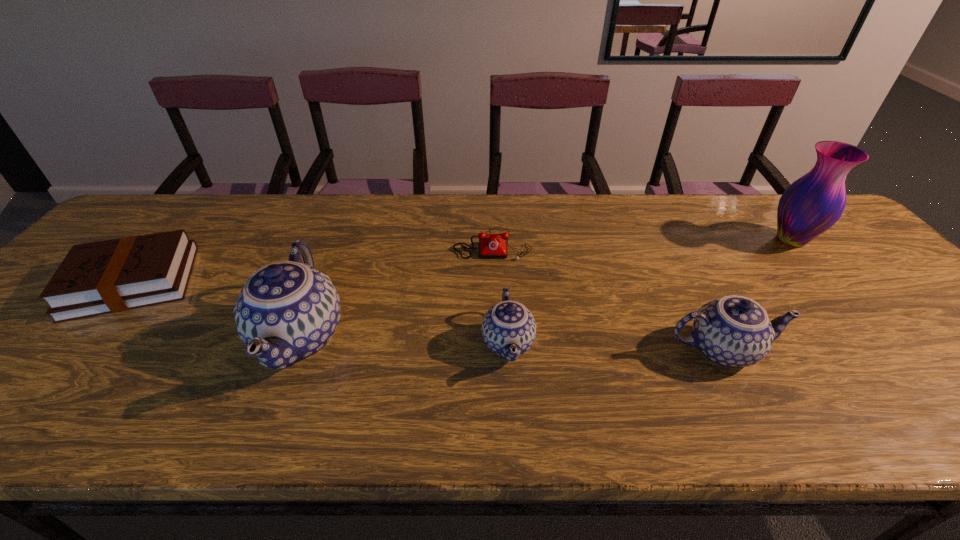
Where is `free space between the leftmost chinaware and the hardback book`? free space between the leftmost chinaware and the hardback book is located at coordinates (216, 309).

Find the location of `vacant space that's between the vase and the fifth shortest object`. vacant space that's between the vase and the fifth shortest object is located at coordinates (545, 288).

Where is `blank region between the tallest object and the leftmost chinaware`? blank region between the tallest object and the leftmost chinaware is located at coordinates (545, 288).

Locate an element on the screen. This screenshot has width=960, height=540. vacant region between the second shortest chinaware and the telephone is located at coordinates (607, 297).

Identify the location of object that is the fourth closest to the second tallest chinaware. (287, 311).

Identify which object is the third nearest to the second object from left to right. Please provide its 2D coordinates. Your answer should be formatted as a tuple, i.e. [(x, y)], where the tuple contains the x and y coordinates of a point satisfying the conditions above.

[(509, 329)]

Locate which chinaware is the second closest to the vase. Please provide its 2D coordinates. Your answer should be formatted as a tuple, i.e. [(x, y)], where the tuple contains the x and y coordinates of a point satisfying the conditions above.

[(509, 329)]

Find the location of `chinaware object that ranks as the second closest to the fifth tallest object`. chinaware object that ranks as the second closest to the fifth tallest object is located at coordinates (509, 329).